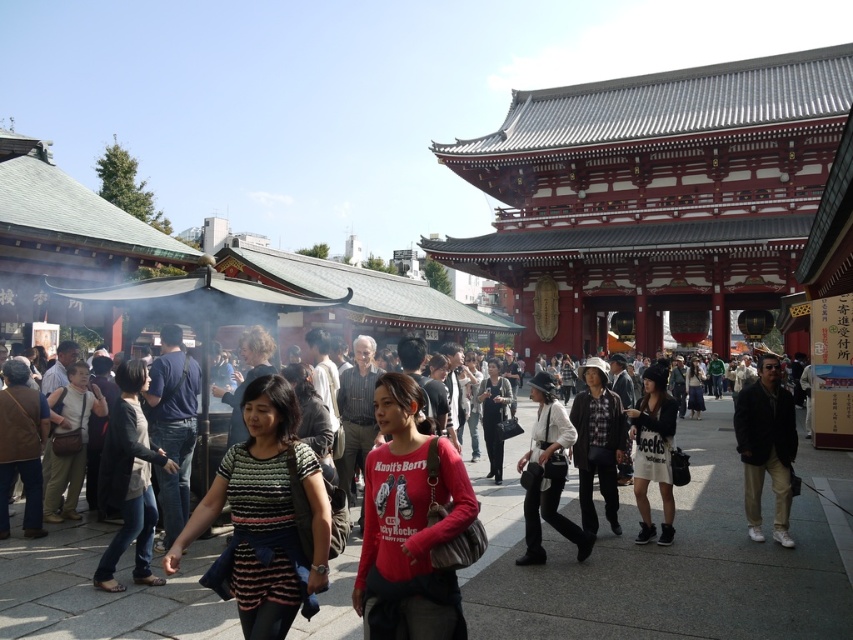
Who is taller, white matte jacket at center or black matte jacket at center?

With more height is white matte jacket at center.

Who is more forward, [547,419] or [486,380]?

Positioned in front is point [547,419].

Locate an element on the screen. The image size is (853, 640). white matte jacket at center is located at coordinates (547, 474).

The image size is (853, 640). What are the coordinates of `white matte jacket at center` in the screenshot? It's located at [547, 474].

Can you confirm if white matte jacket at center is positioned to the left of brown leather jacket at lower left?

Incorrect, white matte jacket at center is not on the left side of brown leather jacket at lower left.

Between point (556, 481) and point (48, 416), which one is positioned in front?

Point (556, 481)

The width and height of the screenshot is (853, 640). I want to click on white matte jacket at center, so click(x=547, y=474).

How much distance is there between dark gray fabric jacket at center and white matte jacket at center?

24.37 meters

Which is more to the left, dark gray fabric jacket at center or white matte jacket at center?

dark gray fabric jacket at center

Who is more distant from viewer, (148, 454) or (550, 392)?

Point (550, 392)

At what (x,y) coordinates should I click in order to perform the action: click on dark gray fabric jacket at center. Please return your answer as a coordinate pair (x, y). Image resolution: width=853 pixels, height=640 pixels. Looking at the image, I should click on (129, 480).